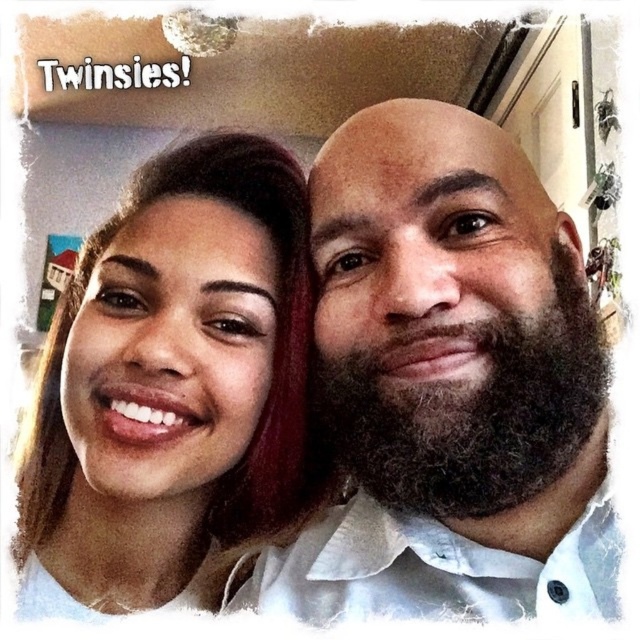
Question: Can you confirm if matte white shirt at left is positioned below dark brown thick beard at right?

Choices:
 (A) yes
 (B) no

Answer: (B)

Question: Which of the following is the farthest from the observer?

Choices:
 (A) (67, 440)
 (B) (353, 401)

Answer: (A)

Question: Is matte white shirt at left above dark brown thick beard at right?

Choices:
 (A) yes
 (B) no

Answer: (A)

Question: Can you confirm if matte white shirt at left is positioned to the left of dark brown thick beard at right?

Choices:
 (A) no
 (B) yes

Answer: (B)